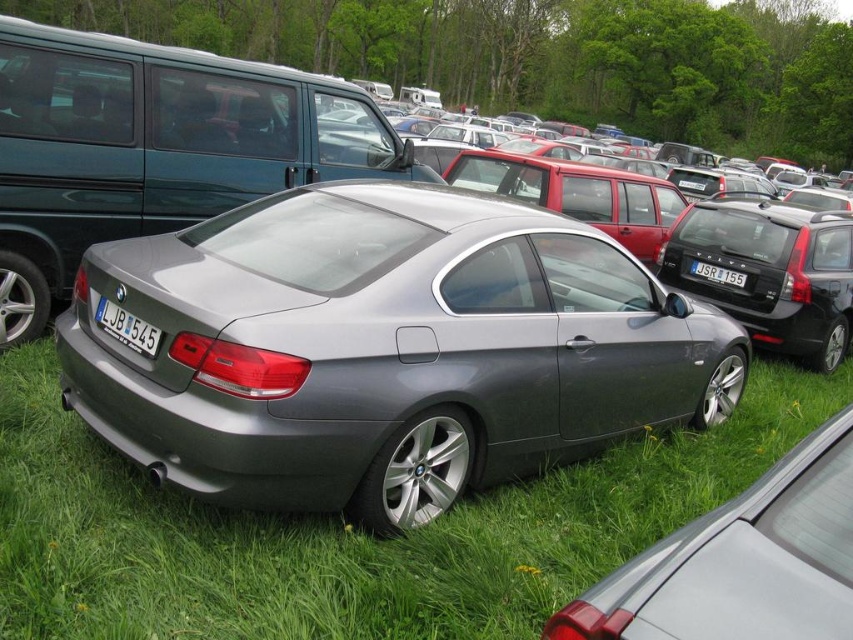
Looking at this image, you are a photographer setting up a shot of the gray BMW coupe in the parking area. You have two points marked on your camera screen at coordinates point (305, 547) and point (138, 333). Which point is closer to the camera lens?

Point (305, 547) is further to the camera than point (138, 333), so the point closer to the camera lens is point (138, 333).

You are a parking attendant checking vehicle dimensions. The satin metallic car at center has a width of 1.8 meters. The white plastic license plate at center is 0.3 meters wide. Can the license plate fit on the car without overlapping other parts?

The satin metallic car at center is bigger than the white plastic license plate at center. Since the car is 1.8 meters wide and the license plate is 0.3 meters wide, there is sufficient space for the license plate to fit without overlapping other parts.